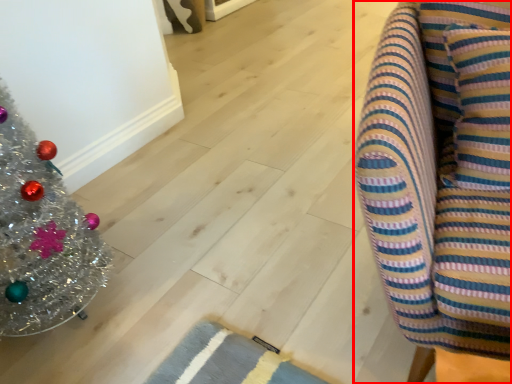
Question: From the image's perspective, considering the relative positions of furniture (annotated by the red box) and christmas tree in the image provided, where is furniture (annotated by the red box) located with respect to the staircase?

Choices:
 (A) below
 (B) above

Answer: (B)